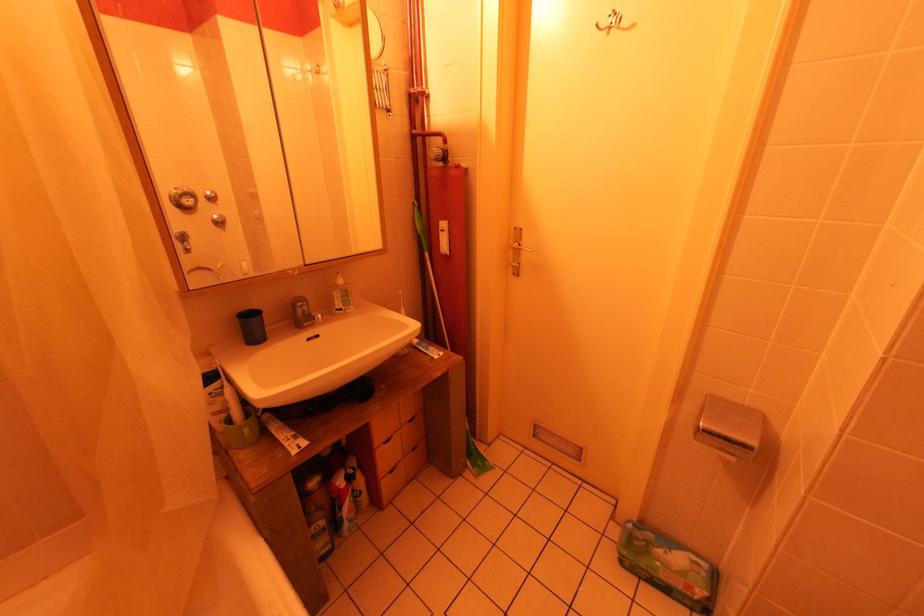
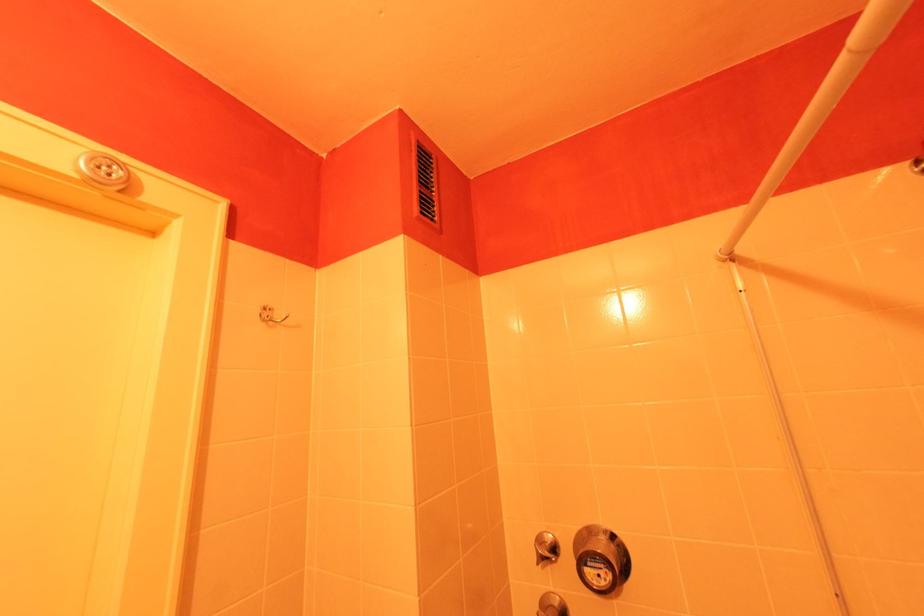
Question: How did the camera likely rotate?

Choices:
 (A) Left
 (B) Right
 (C) Up
 (D) Down

Answer: (B)